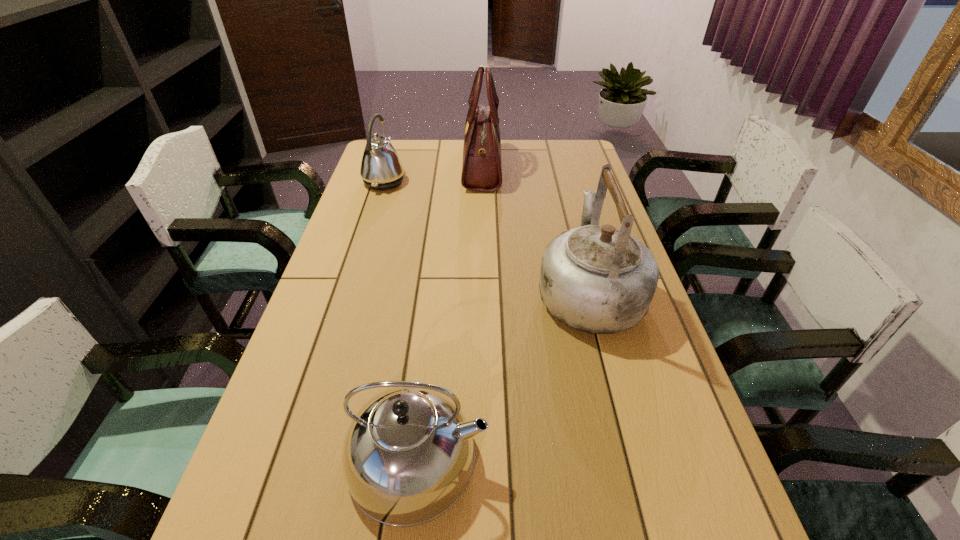
What are the coordinates of `vacant space located at the spout of the tallest kettle` in the screenshot? It's located at (572, 227).

In order to click on vacant area situated at the spout of the tallest kettle in this screenshot , I will do `click(568, 213)`.

The image size is (960, 540). What are the coordinates of `vacant space located 0.090m at the spout of the tallest kettle` in the screenshot? It's located at (573, 233).

Where is `vacant region located on the right of the leftmost object`? vacant region located on the right of the leftmost object is located at coordinates (493, 181).

The image size is (960, 540). I want to click on free space located 0.060m from the spout of the second kettle from left to right, so click(x=519, y=457).

The image size is (960, 540). In order to click on object that is at the far edge in this screenshot , I will do `click(481, 171)`.

Find the location of `object present at the left edge`. object present at the left edge is located at coordinates (381, 168).

Identify the location of object that is at the right edge. The width and height of the screenshot is (960, 540). (599, 279).

At what (x,y) coordinates should I click in order to perform the action: click on vacant space at the far edge of the desktop. Please return your answer as a coordinate pair (x, y). The image size is (960, 540). Looking at the image, I should click on (535, 147).

In the image, there is a desktop. At what (x,y) coordinates should I click in order to perform the action: click on free space at the left edge. Please return your answer as a coordinate pair (x, y). The width and height of the screenshot is (960, 540). Looking at the image, I should click on click(x=356, y=204).